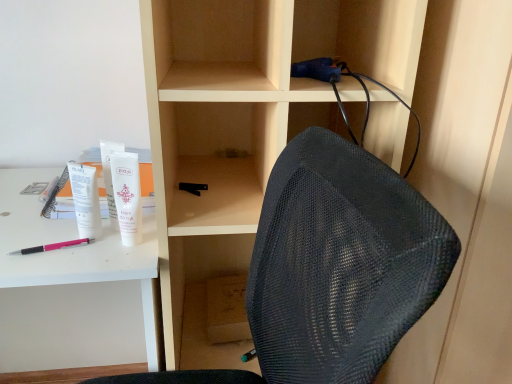
The height and width of the screenshot is (384, 512). What are the coordinates of `free spot to the left of pink plastic pen at lower left` in the screenshot? It's located at point(14,235).